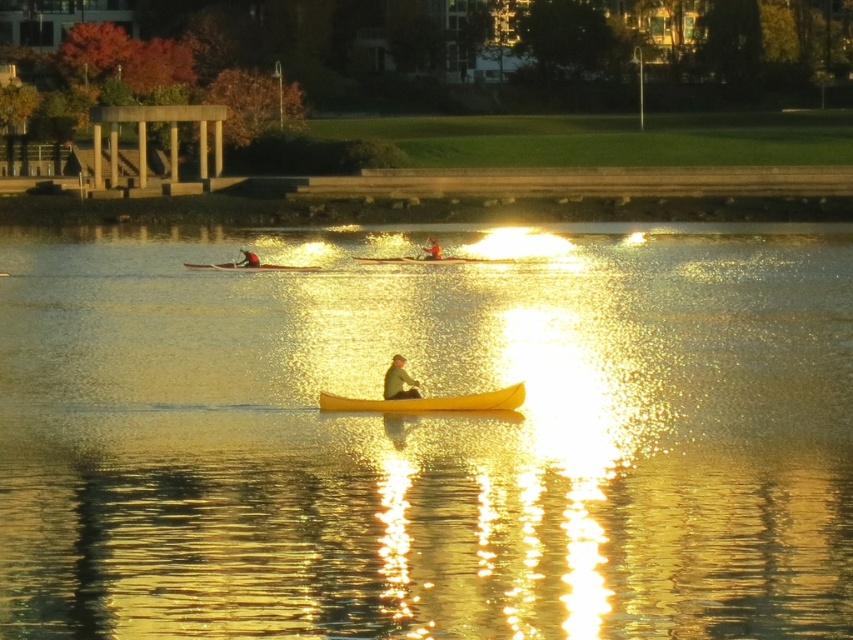
In order to click on yellow matte canoe at center in this screenshot , I will do `click(430, 403)`.

Which is behind, point (387, 404) or point (405, 378)?

The point (405, 378) is more distant.

Is point (474, 404) positioned behind point (397, 365)?

That is False.

Where is `yellow matte canoe at center`? yellow matte canoe at center is located at coordinates (430, 403).

Can you confirm if yellow smooth water at center is smaller than matte black kayak at center?

No.

The height and width of the screenshot is (640, 853). Find the location of `yellow smooth water at center`. yellow smooth water at center is located at coordinates (427, 438).

Who is more distant from viewer, (415, 397) or (431, 250)?

Positioned behind is point (431, 250).

Between yellow matte canoe at center and matte black canoe at center, which one has more height?

matte black canoe at center is taller.

Find the location of a particular element. yellow matte canoe at center is located at coordinates (430, 403).

Locate an element on the screen. The height and width of the screenshot is (640, 853). yellow matte canoe at center is located at coordinates coord(430,403).